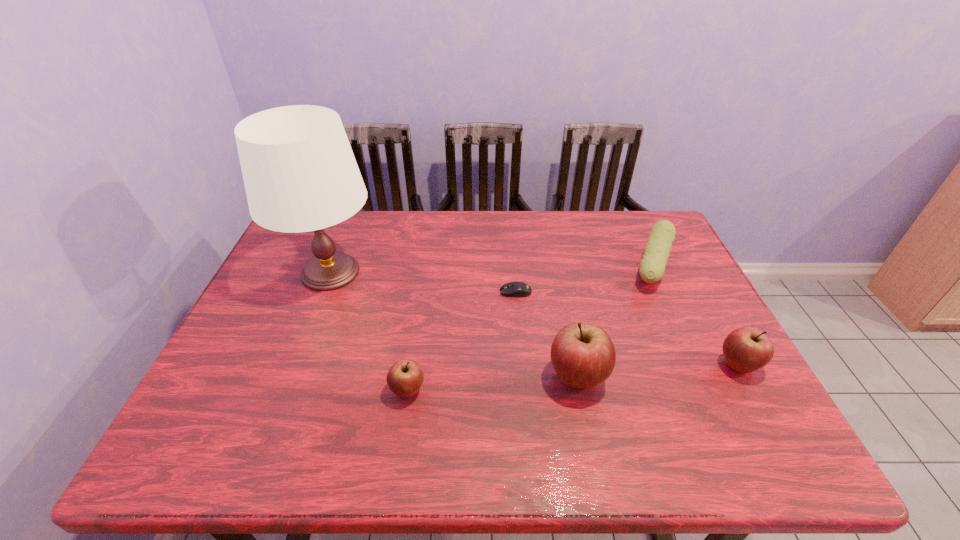
Find the location of `cucumber`. cucumber is located at coordinates (657, 250).

Find the location of a particular element. free region located 0.070m on the left of the shortest apple is located at coordinates (359, 391).

This screenshot has width=960, height=540. Identify the location of free point located on the left of the second tallest object. (509, 378).

Where is `vacant space positioned on the left of the second tallest apple`? vacant space positioned on the left of the second tallest apple is located at coordinates (626, 366).

Locate an element on the screen. The height and width of the screenshot is (540, 960). vacant space located on the wheel side of the shortest object is located at coordinates (359, 292).

Locate an element on the screen. The width and height of the screenshot is (960, 540). free space located on the wheel side of the shortest object is located at coordinates (363, 292).

Image resolution: width=960 pixels, height=540 pixels. Identify the location of free space located 0.340m on the wheel side of the shortest object. (380, 292).

Locate an element on the screen. This screenshot has height=540, width=960. blank space located 0.140m on the back of the leftmost object is located at coordinates (351, 219).

Find the location of a particular element. free spot located 0.130m on the left of the cucumber is located at coordinates (586, 267).

Identify the location of lamp present at the far edge. This screenshot has height=540, width=960. tap(300, 174).